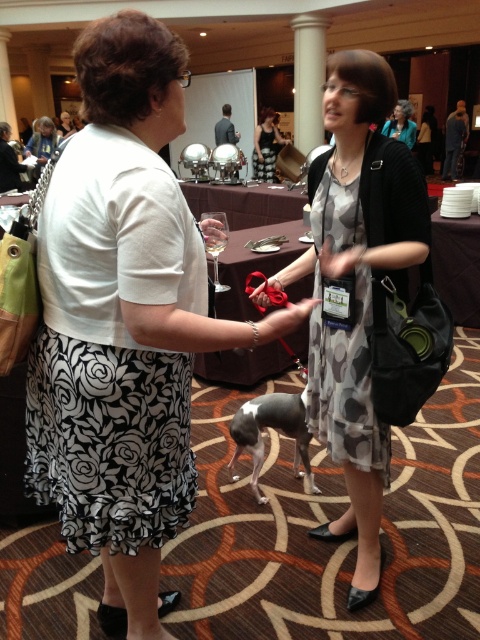
Based on the photo, you are a photographer at the event and want to capture a photo of the printed chiffon dress at center and the clear glass wine glass at center. Which object should you focus on first if you want to ensure both are in focus?

The printed chiffon dress at center is below the clear glass wine glass at center, so you should focus on the clear glass wine glass at center first to ensure both are in focus.

You are a photographer setting up for an event. You need to place a small table between the printed chiffon dress at center and the clear glass wine glass at center. Which object should the table be closer to to ensure it doesn

The printed chiffon dress at center might be wider than the clear glass wine glass at center, so the table should be placed closer to the clear glass wine glass at center to accommodate the dress